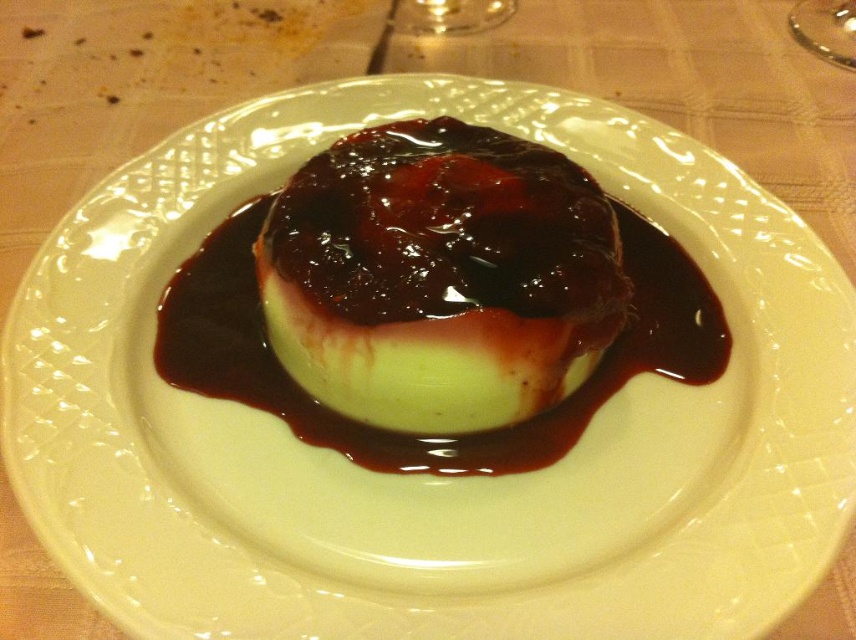
You are a food stylist who needs to place a 10 cm wide decorative ring on the table. The ring must be placed between the white creamy pudding at center and the transparent glass at upper right. Can the ring fit between them without overlapping either item?

The white creamy pudding at center might be wider than transparent glass at upper right, so the ring may not fit between them without overlapping if the distance between them is less than 10 cm.

You are a food critic evaluating this dessert. You notice the white creamy pudding at center and the transparent glass at upper right. Which object is located closer to the top of the image?

The transparent glass at upper right is closer to the top of the image because it is positioned above the white creamy pudding at center.

You are a food critic standing at a distance of 30 inches from the dessert. Can you reach out and touch the white creamy pudding at center?

The white creamy pudding at center is 31.79 inches away from the viewer, so you are 1.79 inches too far to reach it.